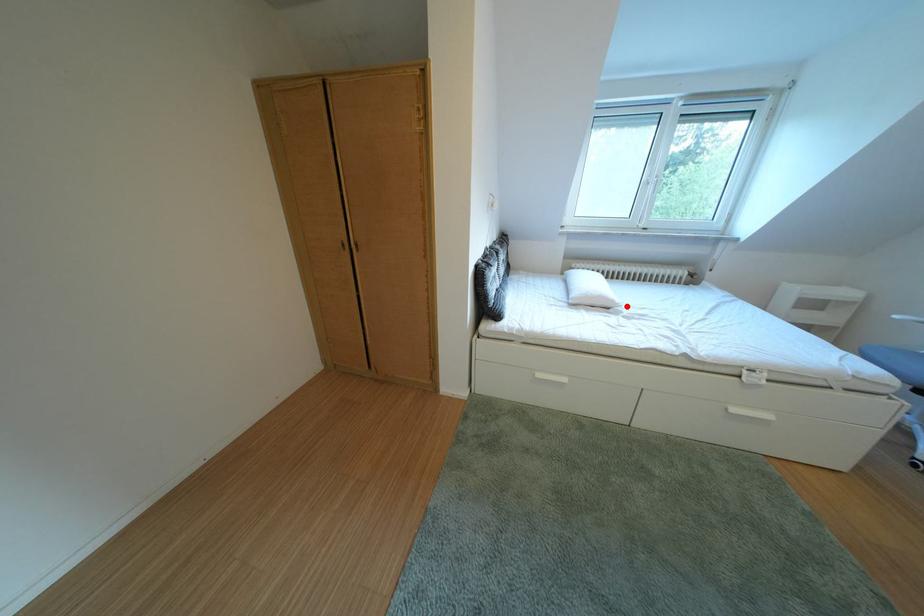
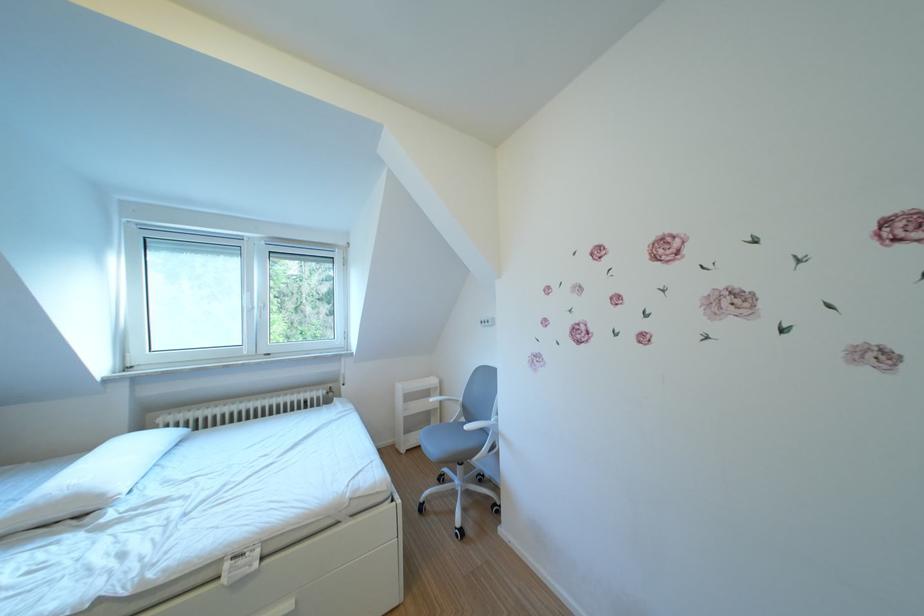
Locate, in the second image, the point that corresponds to the highlighted location in the first image.

(115, 501)